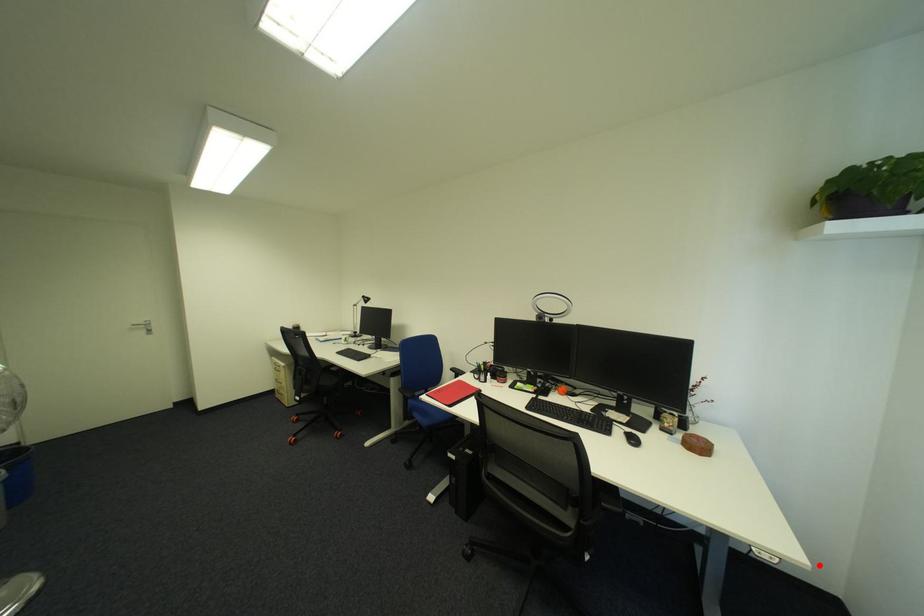
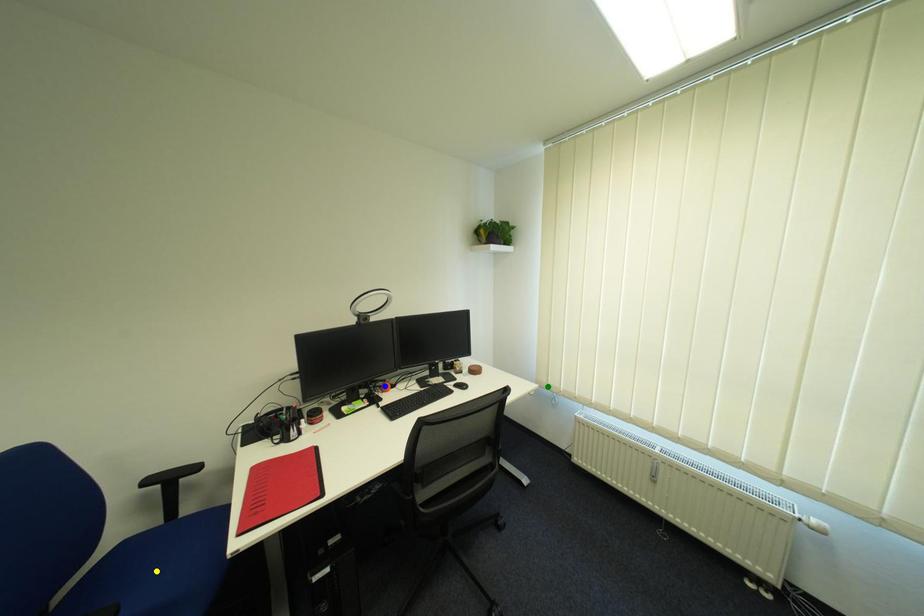
Question: I am providing you with two images of the same scene from different viewpoints. A red point is marked on the first image. You are given multiple points on the second image. Which mark in image 2 goes with the point in image 1?

Choices:
 (A) yellow point
 (B) green point
 (C) blue point

Answer: (B)